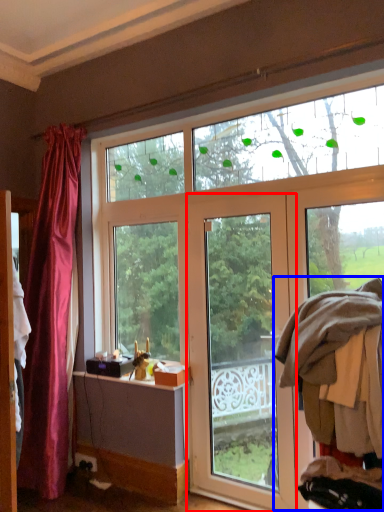
Question: Which object appears closest to the camera in this image, door (highlighted by a red box) or laundry (highlighted by a blue box)?

Choices:
 (A) door
 (B) laundry

Answer: (B)